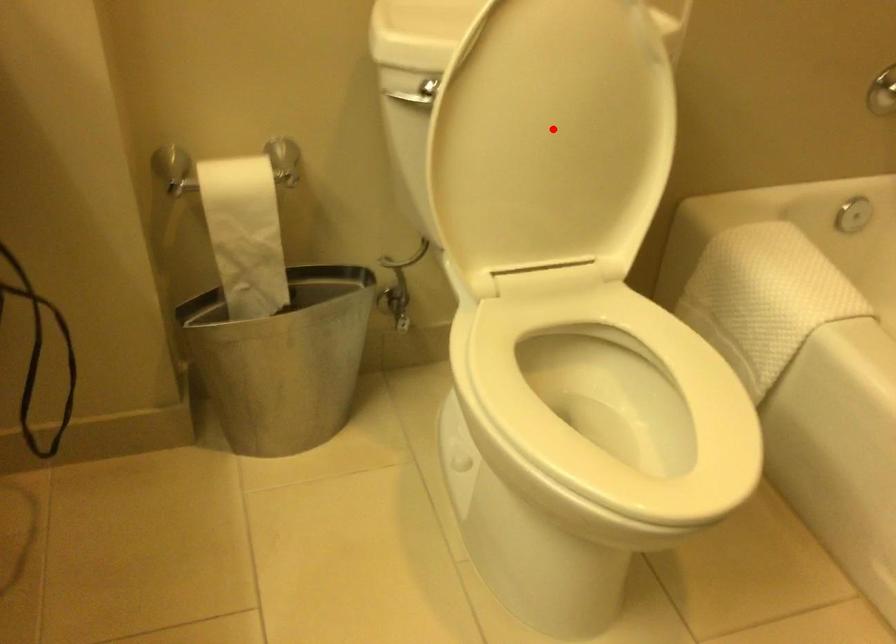
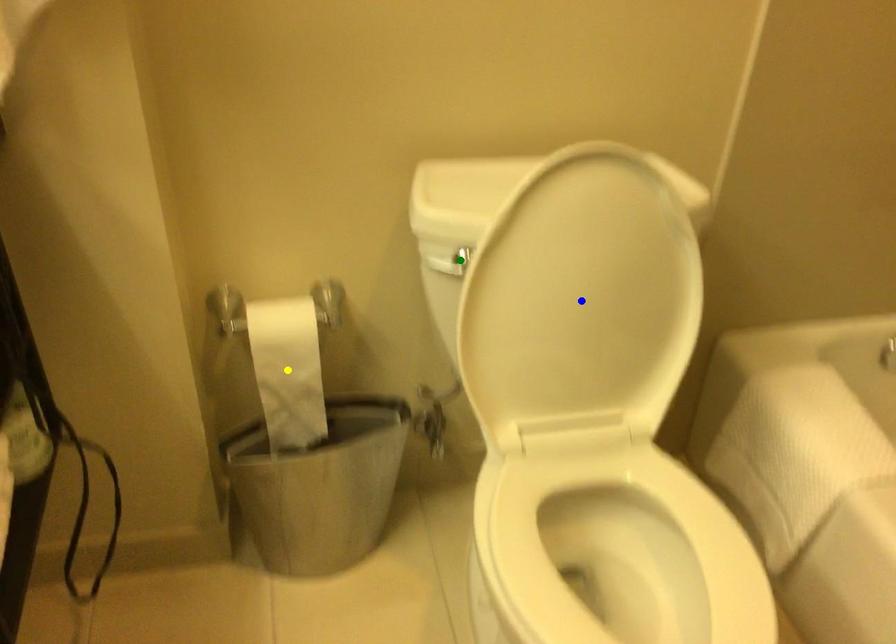
Question: I am providing you with two images of the same scene from different viewpoints. A red point is marked on the first image. You are given multiple points on the second image. Which point in image 2 represents the same 3d spot as the red point in image 1?

Choices:
 (A) green point
 (B) yellow point
 (C) blue point

Answer: (C)